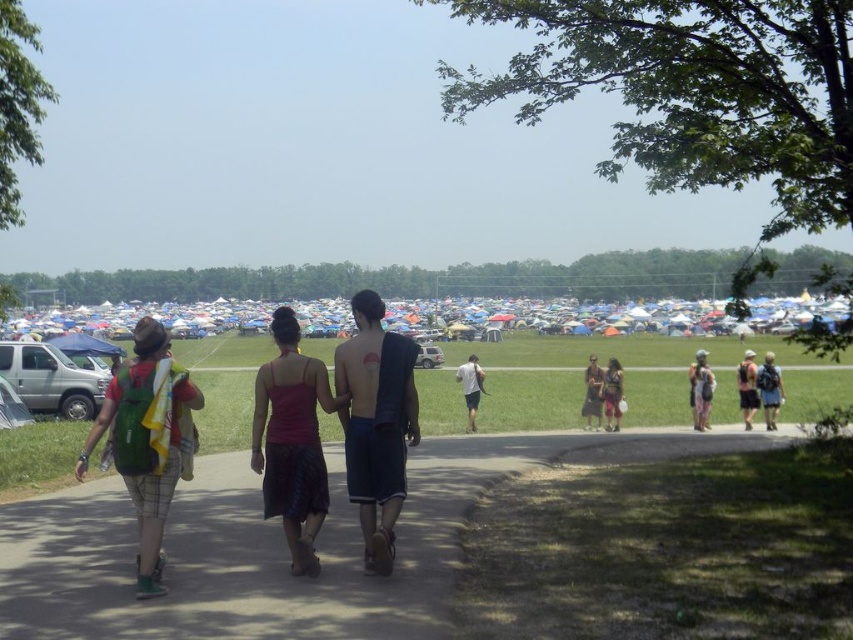
Question: Does green fabric backpack at left appear on the left side of silver metallic van at left?

Choices:
 (A) yes
 (B) no

Answer: (B)

Question: Which of the following is the farthest from the observer?

Choices:
 (A) shiny blue shorts at center
 (B) matte black backpack at center-right
 (C) shiny metallic backpack at center

Answer: (B)

Question: Can you confirm if silver metallic van at left is positioned to the left of matte black dress at center?

Choices:
 (A) no
 (B) yes

Answer: (B)

Question: Can you confirm if matte green backpack at right is positioned below light gray fabric shorts at center?

Choices:
 (A) yes
 (B) no

Answer: (B)

Question: Which object appears closest to the camera in this image?

Choices:
 (A) matte green backpack at right
 (B) brown asphalt pavement at center
 (C) light gray fabric shorts at center

Answer: (B)

Question: Among these points, which one is nearest to the camera?

Choices:
 (A) (612, 384)
 (B) (770, 364)

Answer: (A)